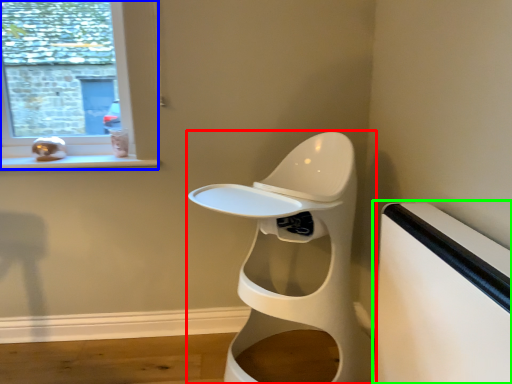
Question: Estimate the real-world distances between objects in this image. Which object is closer to toilet (highlighted by a red box), window (highlighted by a blue box) or table (highlighted by a green box)?

Choices:
 (A) window
 (B) table

Answer: (B)